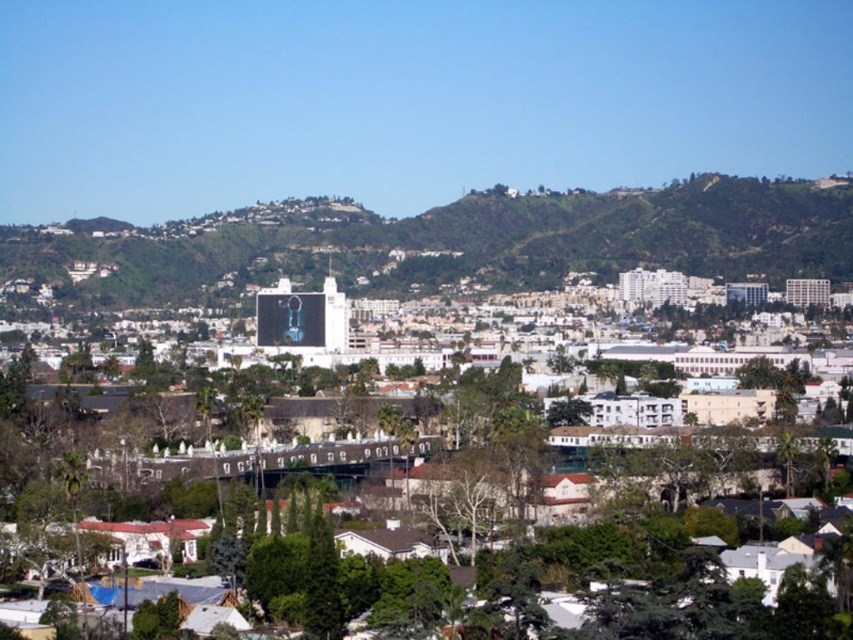
Can you confirm if green grassy hill at center is thinner than green leafy tree at center?

Incorrect, green grassy hill at center's width is not less than green leafy tree at center's.

Between point (231, 218) and point (403, 445), which one is positioned in front?

Point (403, 445) is in front.

Who is more distant from viewer, (654, 227) or (535, 552)?

Positioned behind is point (654, 227).

Where is `green grassy hill at center`? This screenshot has height=640, width=853. green grassy hill at center is located at coordinates (456, 241).